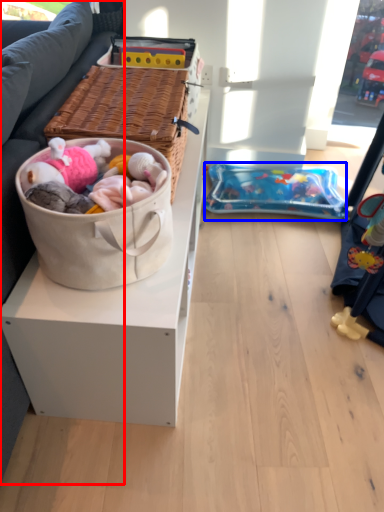
Question: Which of the following is the farthest to the observer, studio couch (highlighted by a red box) or infant bed (highlighted by a blue box)?

Choices:
 (A) studio couch
 (B) infant bed

Answer: (B)